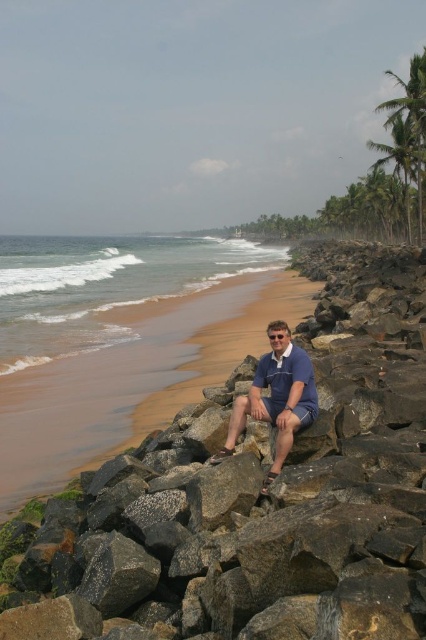
Where is the blue cotton shirt at center located in the image?

The blue cotton shirt at center is located at point 0.622 on the x axis and 0.648 on the y axis.

You are standing at the beach and see two points marked on the rocky embankment. The first point is at coordinates point (290, 406) and the second is at point (377, 109). Which point is closer to you?

Point (290, 406) is closer to the viewer than point (377, 109).

You are planning to build a small sandcastle on the beach. You need a base that is wider than the gray rough rock at center. Can the brown sand at lower left provide a suitable base for your sandcastle?

The gray rough rock at center is wider than the brown sand at lower left, so the sand at lower left is not wide enough to provide a suitable base for your sandcastle.